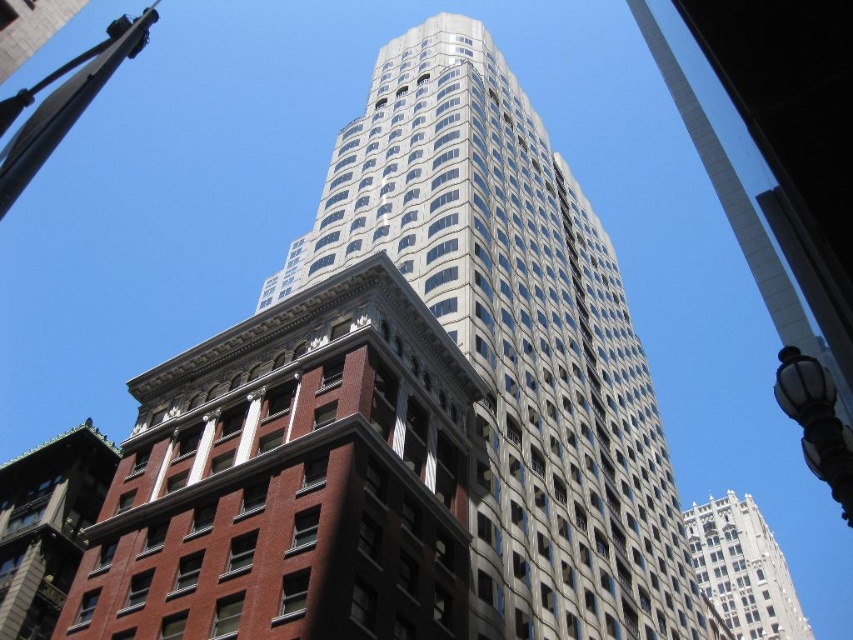
Does red brick building at lower left appear on the left side of white stone tower at upper center?

Correct, you'll find red brick building at lower left to the left of white stone tower at upper center.

Does red brick building at lower left have a smaller size compared to white stone tower at upper center?

Correct, red brick building at lower left occupies less space than white stone tower at upper center.

Identify the location of red brick building at lower left. (47, 524).

This screenshot has width=853, height=640. Identify the location of red brick building at lower left. (47, 524).

Between white stone tower at upper center and black glass streetlight at lower right, which one appears on the left side from the viewer's perspective?

Positioned to the left is white stone tower at upper center.

Where is `white stone tower at upper center`? The image size is (853, 640). white stone tower at upper center is located at coordinates (743, 570).

Between glassy reflective skyscraper at center and white stone tower at upper center, which one appears on the right side from the viewer's perspective?

From the viewer's perspective, white stone tower at upper center appears more on the right side.

Who is lower down, glassy reflective skyscraper at center or white stone tower at upper center?

white stone tower at upper center

The image size is (853, 640). What do you see at coordinates (515, 340) in the screenshot?
I see `glassy reflective skyscraper at center` at bounding box center [515, 340].

This screenshot has height=640, width=853. I want to click on glassy reflective skyscraper at center, so click(515, 340).